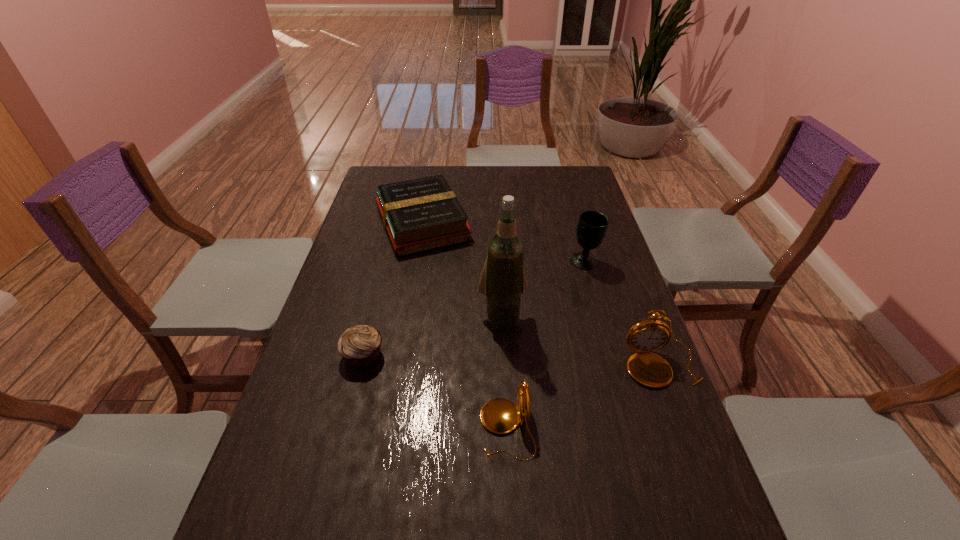
You are a GUI agent. You are given a task and a screenshot of the screen. Output one action in this format:
    pyautogui.click(x=<x>, y=<y>)
    Task: Click on the free space located 0.210m on the face of the shorter pocket watch
    Image resolution: width=960 pixels, height=540 pixels.
    Given the screenshot: What is the action you would take?
    [386, 429]

Find the location of a particular element. The width and height of the screenshot is (960, 540). blank space located on the face of the shorter pocket watch is located at coordinates (364, 429).

Find the location of a particular element. The height and width of the screenshot is (540, 960). vacant space located 0.080m on the back of the muffin is located at coordinates (372, 316).

Identify the location of free space located on the front-facing side of the tallest object. The image size is (960, 540). (506, 387).

Where is `vacant space located 0.060m on the front of the hardback book`? The height and width of the screenshot is (540, 960). vacant space located 0.060m on the front of the hardback book is located at coordinates (414, 271).

At what (x,y) coordinates should I click in order to perform the action: click on free space located on the left of the chalice. Please return your answer as a coordinate pair (x, y). Looking at the image, I should click on (480, 261).

Locate an element on the screen. The image size is (960, 540). object present at the far edge is located at coordinates (419, 215).

You are a GUI agent. You are given a task and a screenshot of the screen. Output one action in this format:
    pyautogui.click(x=<x>, y=<y>)
    Task: Click on the muffin present at the left edge
    The height and width of the screenshot is (540, 960).
    Given the screenshot: What is the action you would take?
    pyautogui.click(x=359, y=346)

The image size is (960, 540). I want to click on hardback book present at the left edge, so click(x=419, y=215).

Locate an element on the screen. pocket watch at the right edge is located at coordinates (649, 369).